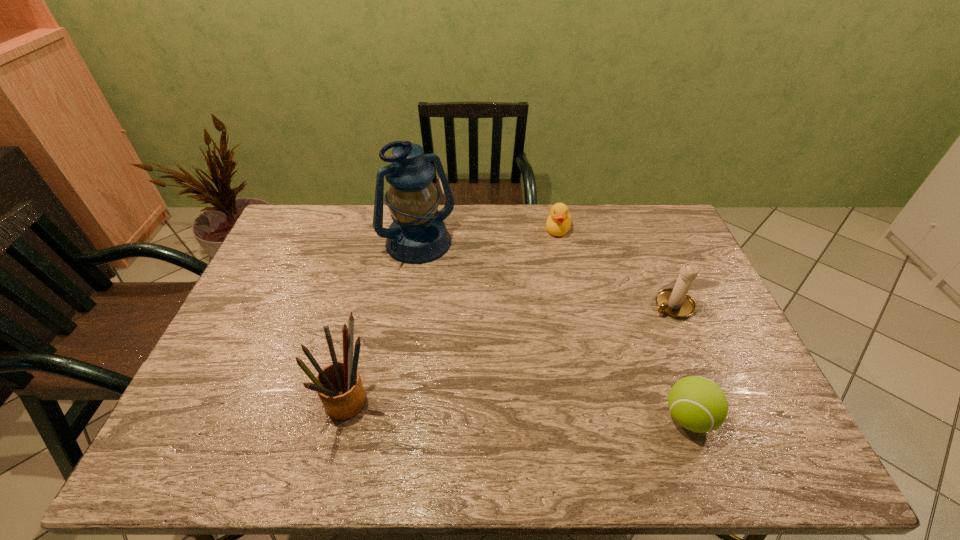
Locate an element on the screen. This screenshot has width=960, height=540. vacant spot on the desktop that is between the fourth shortest object and the tennis ball and is positioned on the handle side of the third nearest object is located at coordinates (508, 411).

Find the location of `vacant space on the desktop that is between the pencil box and the tennis ball and is positioned on the face of the tallest object`. vacant space on the desktop that is between the pencil box and the tennis ball and is positioned on the face of the tallest object is located at coordinates (549, 413).

Identify the location of vacant spot on the desktop that is between the fourth shortest object and the tennis ball and is positioned on the face of the third object from left to right. (495, 411).